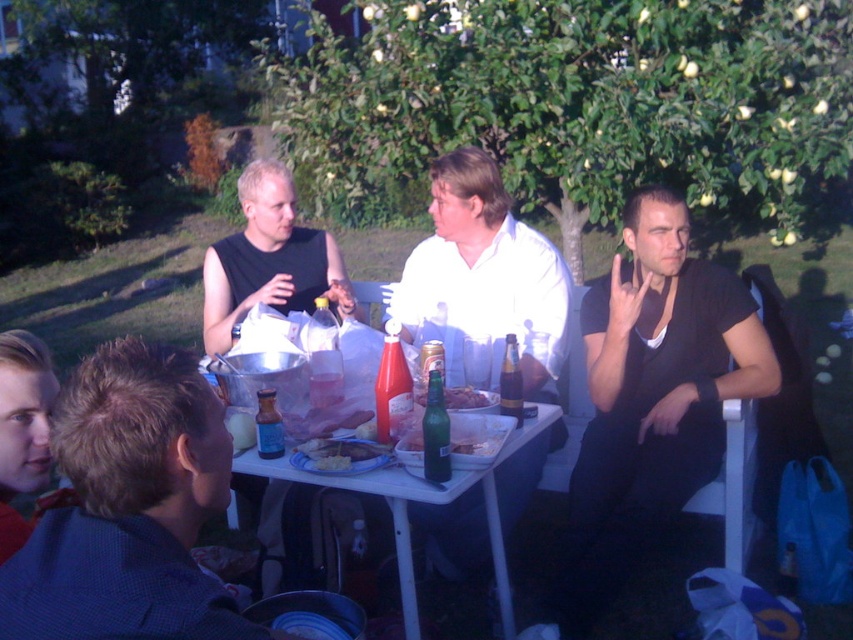
Question: In this image, where is white matte shirt at center located relative to translucent plastic bottle at center?

Choices:
 (A) right
 (B) left

Answer: (A)

Question: Is black matte shirt at right to the right of white creamy food at table center from the viewer's perspective?

Choices:
 (A) no
 (B) yes

Answer: (B)

Question: Does green leafy apple tree at upper center appear over white creamy food at table center?

Choices:
 (A) yes
 (B) no

Answer: (A)

Question: Which of the following is the closest to the observer?

Choices:
 (A) shiny plastic bottle at center
 (B) white plastic table at center
 (C) green glass bottle at table center

Answer: (B)

Question: Which of these objects is positioned farthest from the blue glass bottle at table center?

Choices:
 (A) white plastic table at center
 (B) black matte shirt at right
 (C) brown hair at lower left
 (D) shiny plastic bottle at center

Answer: (B)

Question: Estimate the real-world distances between objects in this image. Which object is farther from the green leafy apple tree at upper center?

Choices:
 (A) shiny plastic bottle at center
 (B) green glass bottle at table center
 (C) white creamy food at table center

Answer: (C)